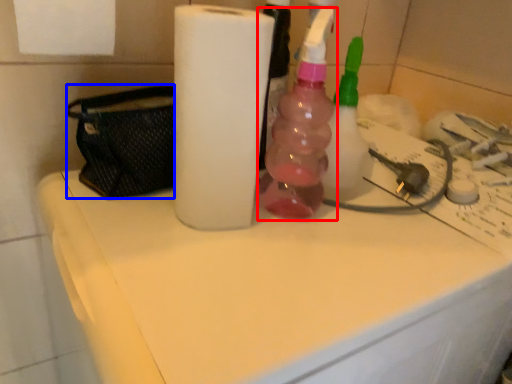
Question: Which object is closer to the camera taking this photo, bottle (highlighted by a red box) or pouch (highlighted by a blue box)?

Choices:
 (A) bottle
 (B) pouch

Answer: (B)